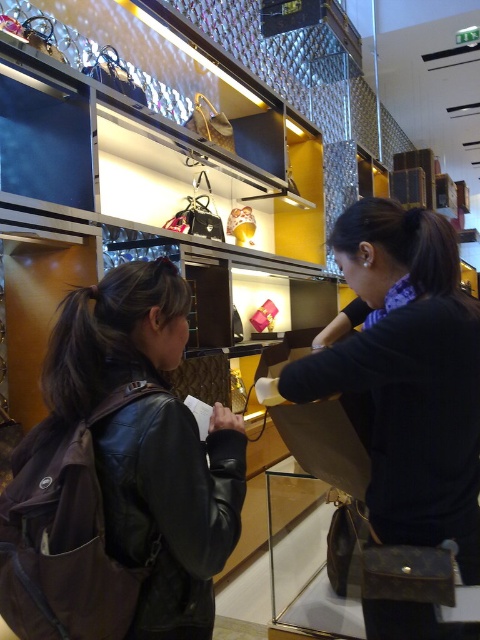
Is point (216, 493) closer to camera compared to point (340, 349)?

Yes.

Which is in front, point (84, 602) or point (445, 305)?

Point (84, 602) is more forward.

Where is `black leather jacket at lower left`? black leather jacket at lower left is located at coordinates (120, 476).